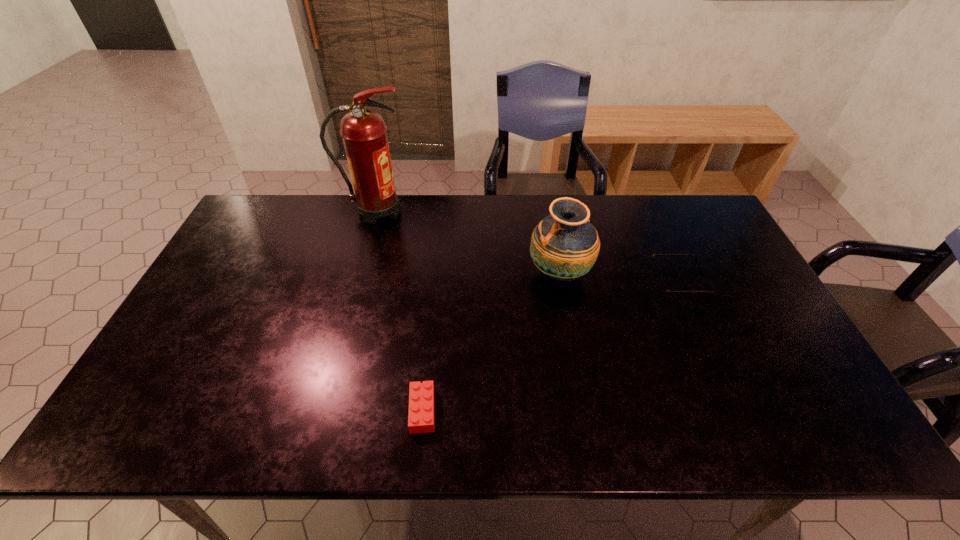
You are a GUI agent. You are given a task and a screenshot of the screen. Output one action in this format:
    pyautogui.click(x=<x>, y=<y>)
    Task: Click on the empty location between the leftmost object and the rightmost object
    The image size is (960, 540).
    Given the screenshot: What is the action you would take?
    pyautogui.click(x=528, y=247)

You are a GUI agent. You are given a task and a screenshot of the screen. Output one action in this format:
    pyautogui.click(x=<x>, y=<y>)
    Task: Click on the free space between the second tallest object and the tallest object
    This screenshot has width=960, height=540.
    Given the screenshot: What is the action you would take?
    pyautogui.click(x=468, y=242)

Identify which object is located as the third nearest to the fire extinguisher. Please provide its 2D coordinates. Your answer should be formatted as a tuple, i.e. [(x, y)], where the tuple contains the x and y coordinates of a point satisfying the conditions above.

[(663, 291)]

Image resolution: width=960 pixels, height=540 pixels. Find the location of `object that stands as the second closest to the rightmost object`. object that stands as the second closest to the rightmost object is located at coordinates (421, 417).

Where is `vacant space that satisfies the following two spatial constraints: 1. at the hinge ends of the third tallest object; 2. on the front side of the shortest object`? vacant space that satisfies the following two spatial constraints: 1. at the hinge ends of the third tallest object; 2. on the front side of the shortest object is located at coordinates (735, 410).

I want to click on vacant space that satisfies the following two spatial constraints: 1. on the front-facing side of the shortest object; 2. on the right side of the tallest object, so click(323, 410).

The image size is (960, 540). Find the location of `vacant position in the image that satisfies the following two spatial constraints: 1. on the front-facing side of the second tallest object; 2. on the right side of the fire extinguisher`. vacant position in the image that satisfies the following two spatial constraints: 1. on the front-facing side of the second tallest object; 2. on the right side of the fire extinguisher is located at coordinates click(x=360, y=273).

Identify the location of free space that satisfies the following two spatial constraints: 1. on the front-facing side of the third object from left to right; 2. on the right side of the leftmost object. The width and height of the screenshot is (960, 540). (360, 273).

Identify the location of vacant space that satisfies the following two spatial constraints: 1. at the hinge ends of the third tallest object; 2. on the front side of the Lego. (735, 410).